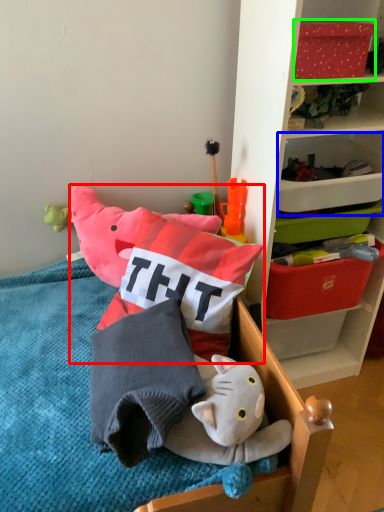
Question: Estimate the real-world distances between objects in this image. Which object is closer to toy (highlighted by a red box), storage box (highlighted by a blue box) or storage box (highlighted by a green box)?

Choices:
 (A) storage box
 (B) storage box

Answer: (A)